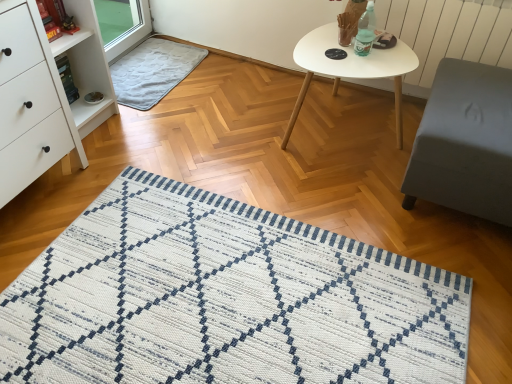
Question: Is white matte chest of drawers at left further to the viewer compared to white textured radiator at upper right?

Choices:
 (A) no
 (B) yes

Answer: (A)

Question: Can you confirm if white matte chest of drawers at left is wider than white textured radiator at upper right?

Choices:
 (A) yes
 (B) no

Answer: (A)

Question: Is white matte chest of drawers at left with white textured radiator at upper right?

Choices:
 (A) yes
 (B) no

Answer: (B)

Question: Is white textured radiator at upper right located within white matte chest of drawers at left?

Choices:
 (A) yes
 (B) no

Answer: (B)

Question: Does white matte chest of drawers at left appear on the left side of white textured radiator at upper right?

Choices:
 (A) no
 (B) yes

Answer: (B)

Question: Can you confirm if white matte chest of drawers at left is smaller than white textured radiator at upper right?

Choices:
 (A) no
 (B) yes

Answer: (A)

Question: Does white textured radiator at upper right have a greater width compared to gray soft rug at upper left?

Choices:
 (A) yes
 (B) no

Answer: (B)

Question: Can you confirm if white textured radiator at upper right is bigger than gray soft rug at upper left?

Choices:
 (A) yes
 (B) no

Answer: (A)

Question: Is white textured radiator at upper right shorter than gray soft rug at upper left?

Choices:
 (A) yes
 (B) no

Answer: (B)

Question: From a real-world perspective, is white textured radiator at upper right on top of gray soft rug at upper left?

Choices:
 (A) no
 (B) yes

Answer: (B)

Question: Considering the relative positions of white textured radiator at upper right and gray soft rug at upper left in the image provided, is white textured radiator at upper right to the left of gray soft rug at upper left from the viewer's perspective?

Choices:
 (A) yes
 (B) no

Answer: (B)

Question: Is the depth of white textured radiator at upper right less than that of gray soft rug at upper left?

Choices:
 (A) no
 (B) yes

Answer: (B)

Question: Is the depth of translucent plastic bottle at upper right greater than that of white matte oval table at upper center?

Choices:
 (A) yes
 (B) no

Answer: (A)